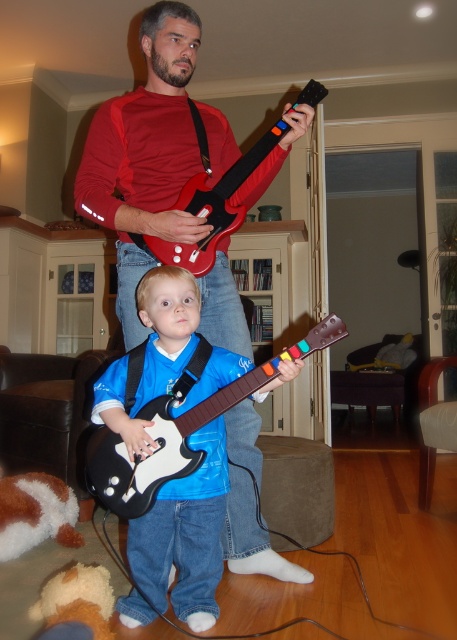
You are a photographer trying to capture a clear photo of the black plastic guitar at center without the brown plush toy at lower left appearing in the frame. Based on their positions, can you adjust your camera angle to achieve this?

The black plastic guitar at center is positioned over the brown plush toy at lower left, so by angling the camera slightly upwards or moving the camera to the side, you can position the black plastic guitar at center in front of the brown plush toy at lower left, thus blocking it from view and ensuring only the guitar is visible.

You are a drone flying above the scene and want to capture a closeup of the point at (158, 442) and the point at (10, 518). Which point should you adjust your camera to focus on first to ensure it is in focus?

You should focus on point (158, 442) first because it is closer to the camera than point (10, 518), so it requires adjusting the focus distance first.

You are standing in the living room and want to place a small plant between the two points labeled as point (202, 176) and point (37, 532). Which point should the plant be closer to in order to be nearer to the camera?

The plant should be placed closer to point (202, 176) because it is closer to the camera than point (37, 532).